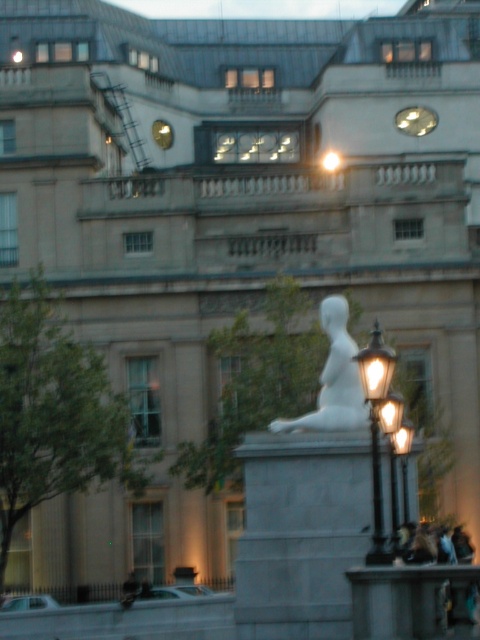
Question: Is the position of white marble statue at center less distant than that of polished brass streetlight at center-right?

Choices:
 (A) yes
 (B) no

Answer: (B)

Question: Which object is closer to the camera taking this photo?

Choices:
 (A) polished brass streetlight at center-right
 (B) white marble statue at center

Answer: (A)

Question: Is white marble statue at center to the right of polished brass streetlight at center-right from the viewer's perspective?

Choices:
 (A) yes
 (B) no

Answer: (B)

Question: Considering the relative positions of white marble statue at center and polished brass streetlight at center-right in the image provided, where is white marble statue at center located with respect to polished brass streetlight at center-right?

Choices:
 (A) right
 (B) left

Answer: (B)

Question: Which point is farther to the camera?

Choices:
 (A) white marble statue at center
 (B) polished brass streetlight at center-right

Answer: (A)